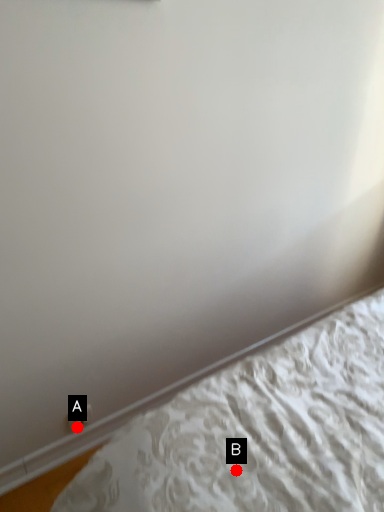
Question: Two points are circled on the image, labeled by A and B beside each circle. Which of the following is the farthest from the observer?

Choices:
 (A) A is further
 (B) B is further

Answer: (A)